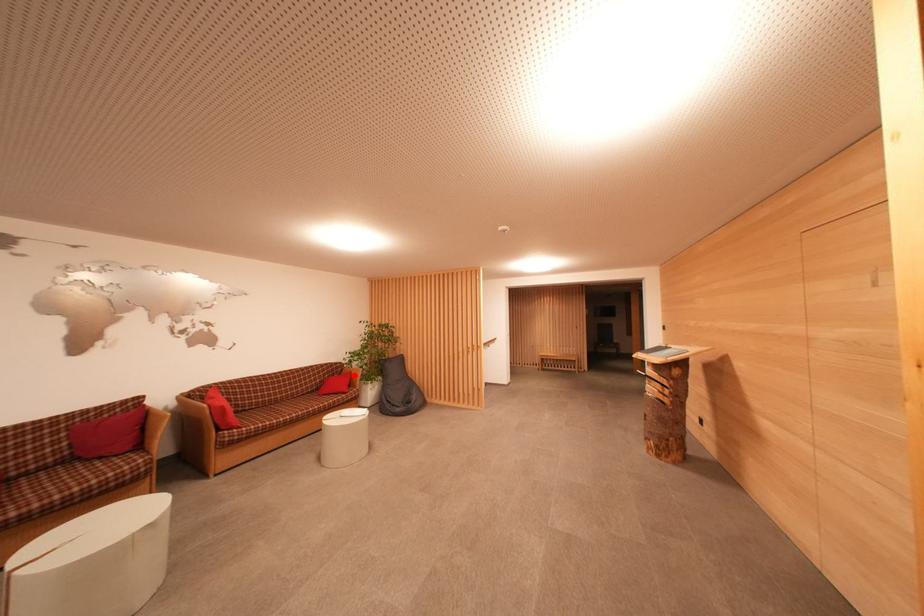
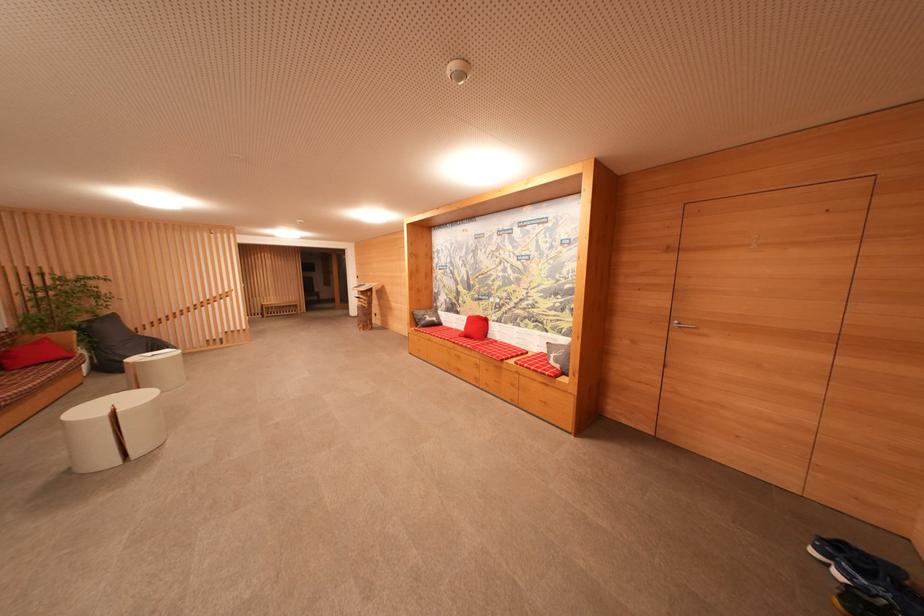
In the second image, find the point that corresponds to the highlighted location in the first image.

(50, 342)